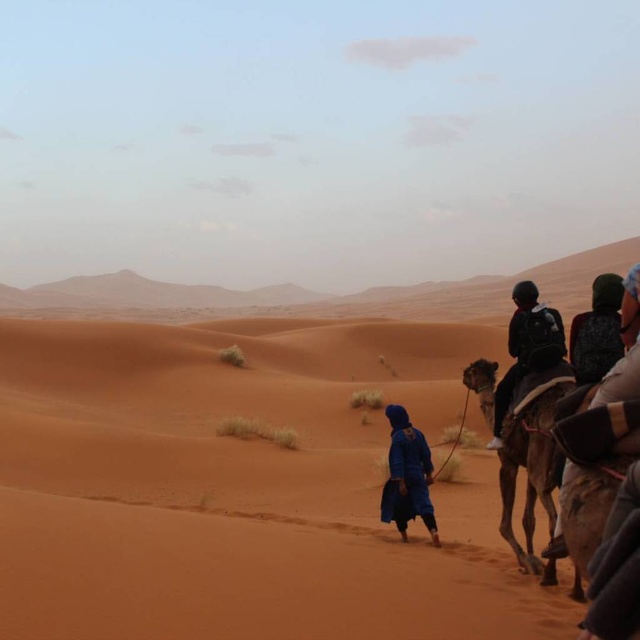
Question: Does sandy/desert-like at center have a lesser width compared to dark blue fabric at right?

Choices:
 (A) no
 (B) yes

Answer: (A)

Question: Which point is farther to the camera?

Choices:
 (A) sandy/desert-like at center
 (B) dark green fabric backpack at right

Answer: (B)

Question: Can you confirm if sandy/desert-like at center is positioned below brown textured camel at right?

Choices:
 (A) no
 (B) yes

Answer: (A)

Question: Among these points, which one is farthest from the camera?

Choices:
 (A) (582, 328)
 (B) (513, 298)
 (C) (476, 378)
 (D) (42, 634)

Answer: (C)

Question: Is brown textured camel at right to the left of blue woolen robe at center from the viewer's perspective?

Choices:
 (A) no
 (B) yes

Answer: (A)

Question: Among these objects, which one is farthest from the camera?

Choices:
 (A) blue woolen robe at center
 (B) dark green fabric backpack at right

Answer: (A)